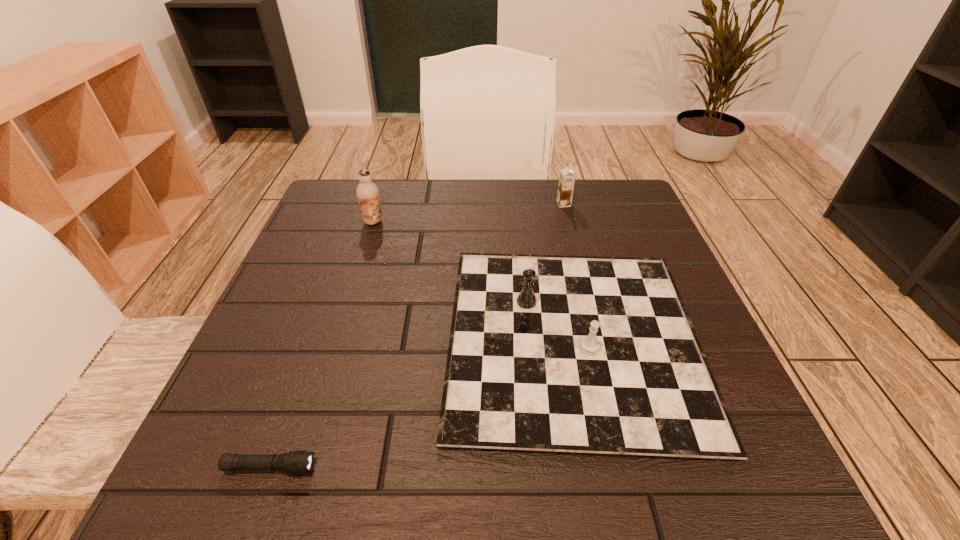
The width and height of the screenshot is (960, 540). I want to click on vacant space at the left edge of the desktop, so click(340, 255).

This screenshot has height=540, width=960. I want to click on vacant space at the far left corner, so click(x=340, y=202).

Where is `vacant region at the far right corner of the desktop`? This screenshot has height=540, width=960. vacant region at the far right corner of the desktop is located at coordinates (590, 214).

The image size is (960, 540). Find the location of `free location at the near right corner of the desktop`. free location at the near right corner of the desktop is located at coordinates (703, 488).

Locate an element on the screen. The width and height of the screenshot is (960, 540). free space between the shortest object and the farther chocolate milk is located at coordinates (417, 335).

This screenshot has width=960, height=540. Identify the location of free space between the nearer chocolate milk and the flashlight. (322, 345).

The width and height of the screenshot is (960, 540). Find the location of `free area in between the gameboard and the shortest object`. free area in between the gameboard and the shortest object is located at coordinates (421, 403).

Locate an element on the screen. The height and width of the screenshot is (540, 960). vacant area between the gameboard and the flashlight is located at coordinates (421, 403).

At what (x,y) coordinates should I click in order to perform the action: click on empty space between the shorter chocolate milk and the nearer chocolate milk. Please return your answer as a coordinate pair (x, y). The width and height of the screenshot is (960, 540). Looking at the image, I should click on (468, 213).

Identify the location of free area in between the flashlight and the left chocolate milk. Image resolution: width=960 pixels, height=540 pixels. (322, 345).